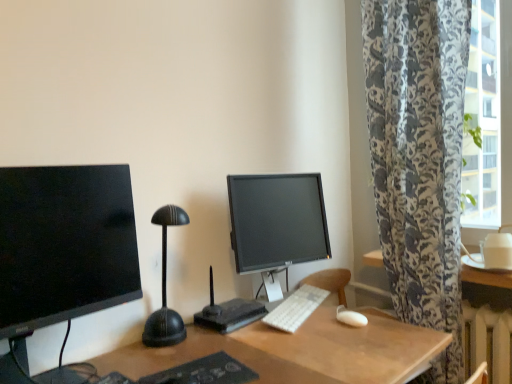
What do you see at coordinates (229, 312) in the screenshot? The width and height of the screenshot is (512, 384). I see `black plastic router at center` at bounding box center [229, 312].

Image resolution: width=512 pixels, height=384 pixels. Identify the location of matte black monitor at left, which is the second computer monitor in back-to-front order. (x=64, y=246).

This screenshot has width=512, height=384. I want to click on white plastic keyboard at center, so click(295, 308).

This screenshot has width=512, height=384. Find the location of `white matte mouse at lower right`. white matte mouse at lower right is located at coordinates (350, 317).

Considering the positions of points (291, 294) and (244, 300), is point (291, 294) farther from camera compared to point (244, 300)?

Yes, point (291, 294) is behind point (244, 300).

Is white plastic keyboard at center thinner than black plastic router at center?

Correct, the width of white plastic keyboard at center is less than that of black plastic router at center.

Identify the location of computer keyboard located behind the black plastic router at center. (295, 308).

How distant is black plastic router at center from white plastic keyboard at center?

5.27 inches.

Consider the image. From the image's perspective, is black plastic router at center located above white plastic keyboard at center?

Correct, black plastic router at center appears higher than white plastic keyboard at center in the image.

Is black plastic router at center positioned with its back to white plastic keyboard at center?

black plastic router at center is not turned away from white plastic keyboard at center.

Between black plastic router at center and white plastic keyboard at center, which one has less height?

white plastic keyboard at center is shorter.

Can you confirm if matte black monitor at center, the 2th computer monitor positioned from the left, is positioned to the left of white matte mouse at lower right?

Correct, you'll find matte black monitor at center, the 2th computer monitor positioned from the left, to the left of white matte mouse at lower right.

Can we say matte black monitor at center, which is the first computer monitor in back-to-front order, lies outside white matte mouse at lower right?

Yes, matte black monitor at center, which is the first computer monitor in back-to-front order, is outside of white matte mouse at lower right.

From a real-world perspective, which is physically above, matte black monitor at center, which ranks as the 2th computer monitor in front-to-back order, or white matte mouse at lower right?

matte black monitor at center, which ranks as the 2th computer monitor in front-to-back order, is physically above.

Which is closer to the camera, (309, 233) or (357, 327)?

Point (309, 233) is farther from the camera than point (357, 327).

Looking at this image, does black plastic router at center lie behind matte black monitor at left, acting as the 1th computer monitor starting from the front?

Result: That is True.

Which is nearer, (x=209, y=312) or (x=116, y=293)?

Point (x=209, y=312) is farther from the camera than point (x=116, y=293).

Is black plastic router at center facing away from matte black monitor at left, acting as the 1th computer monitor starting from the front?

No.

Which is more to the right, black plastic router at center or matte black monitor at left, which is the second computer monitor in back-to-front order?

Positioned to the right is black plastic router at center.

Between white matte mouse at lower right and black plastic router at center, which one has less height?

white matte mouse at lower right is shorter.

Considering the sizes of objects white matte mouse at lower right and black plastic router at center in the image provided, who is bigger, white matte mouse at lower right or black plastic router at center?

black plastic router at center is bigger.

Is white matte mouse at lower right not near black plastic router at center?

white matte mouse at lower right is near black plastic router at center, not far away.

Which object is further away from the camera, white matte mouse at lower right or black plastic router at center?

white matte mouse at lower right is further from the camera.

Does point (115, 170) come in front of point (230, 304)?

Yes, point (115, 170) is closer to viewer.

Is matte black monitor at left, acting as the 1th computer monitor starting from the front, behind black plastic router at center?

No.

In the scene shown: Is there a large distance between matte black monitor at left, acting as the 2th computer monitor starting from the right, and black plastic router at center?

matte black monitor at left, acting as the 2th computer monitor starting from the right, is actually quite close to black plastic router at center.

Is matte black monitor at left, which is the second computer monitor in back-to-front order, wider or thinner than black plastic router at center?

In the image, matte black monitor at left, which is the second computer monitor in back-to-front order, appears to be wider than black plastic router at center.

From a real-world perspective, is matte black monitor at center, the 2th computer monitor positioned from the left, below black plastic router at center?

No, from a real-world perspective, matte black monitor at center, the 2th computer monitor positioned from the left, is not beneath black plastic router at center.

From the image's perspective, which computer monitor is the 2nd one above the black plastic router at center? Please provide its 2D coordinates.

[(277, 223)]

Are matte black monitor at center, which is the first computer monitor in back-to-front order, and black plastic router at center located far from each other?

Actually, matte black monitor at center, which is the first computer monitor in back-to-front order, and black plastic router at center are a little close together.

Does matte black monitor at center, which ranks as the 2th computer monitor in front-to-back order, have a greater width compared to black plastic router at center?

Incorrect, the width of matte black monitor at center, which ranks as the 2th computer monitor in front-to-back order, does not surpass that of black plastic router at center.

Where is `computer keyboard below the black plastic router at center (from the image's perspective)`? computer keyboard below the black plastic router at center (from the image's perspective) is located at coordinates [x=295, y=308].

Identify the location of computer desk in front of the white plastic keyboard at center. (229, 312).

When comparing their distances from matte black monitor at left, which is the second computer monitor in back-to-front order, does white plastic keyboard at center or matte black monitor at center, which is the first computer monitor in back-to-front order, seem closer?

matte black monitor at center, which is the first computer monitor in back-to-front order, is positioned closer to the anchor matte black monitor at left, which is the second computer monitor in back-to-front order.

Considering their positions, is white plastic keyboard at center positioned further to matte black monitor at center, marked as the 1th computer monitor in a right-to-left arrangement, than matte black monitor at left, acting as the 1th computer monitor starting from the front?

Based on the image, matte black monitor at left, acting as the 1th computer monitor starting from the front, appears to be further to matte black monitor at center, marked as the 1th computer monitor in a right-to-left arrangement.

Estimate the real-world distances between objects in this image. Which object is further from white matte mouse at lower right, black plastic router at center or white plastic keyboard at center?

The object further to white matte mouse at lower right is black plastic router at center.

Estimate the real-world distances between objects in this image. Which object is further from matte black monitor at left, acting as the 1th computer monitor starting from the front, matte black monitor at center, which is the first computer monitor in back-to-front order, or white plastic keyboard at center?

white plastic keyboard at center is positioned further to the anchor matte black monitor at left, acting as the 1th computer monitor starting from the front.

Which object lies nearer to the anchor point matte black monitor at left, acting as the 2th computer monitor starting from the right, black plastic router at center or white matte mouse at lower right?

The object closer to matte black monitor at left, acting as the 2th computer monitor starting from the right, is black plastic router at center.

Looking at the image, which one is located further to matte black monitor at center, marked as the 1th computer monitor in a right-to-left arrangement, white matte mouse at lower right or matte black monitor at left, which is the second computer monitor in back-to-front order?

matte black monitor at left, which is the second computer monitor in back-to-front order, is positioned further to the anchor matte black monitor at center, marked as the 1th computer monitor in a right-to-left arrangement.

Considering their positions, is black plastic router at center positioned further to matte black monitor at center, which ranks as the 2th computer monitor in front-to-back order, than white plastic keyboard at center?

black plastic router at center.

Which object lies nearer to the anchor point white matte mouse at lower right, white plastic keyboard at center or matte black monitor at left, acting as the 2th computer monitor starting from the right?

white plastic keyboard at center is closer to white matte mouse at lower right.

I want to click on computer desk between matte black monitor at left, acting as the 1th computer monitor starting from the front, and white plastic keyboard at center, so (x=229, y=312).

This screenshot has height=384, width=512. Find the location of `computer keyboard between black plastic router at center and white matte mouse at lower right in the horizontal direction`. computer keyboard between black plastic router at center and white matte mouse at lower right in the horizontal direction is located at coordinates (295, 308).

Find the location of a particular element. computer desk between matte black monitor at left, acting as the 1th computer monitor starting from the front, and matte black monitor at center, marked as the 1th computer monitor in a right-to-left arrangement, in the front-back direction is located at coordinates (229, 312).

Where is `computer desk between matte black monitor at left, which is the second computer monitor in back-to-front order, and white matte mouse at lower right`? This screenshot has height=384, width=512. computer desk between matte black monitor at left, which is the second computer monitor in back-to-front order, and white matte mouse at lower right is located at coordinates (229, 312).